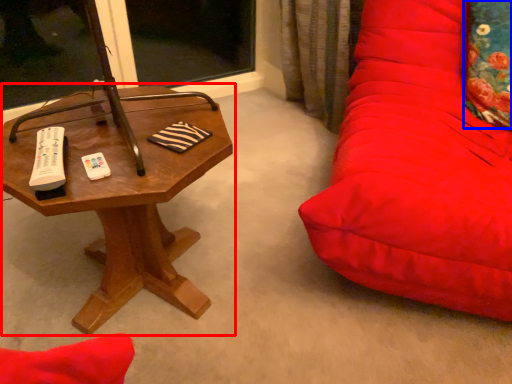
Question: Which point is closer to the camera, table (highlighted by a red box) or throw pillow (highlighted by a blue box)?

Choices:
 (A) table
 (B) throw pillow

Answer: (A)